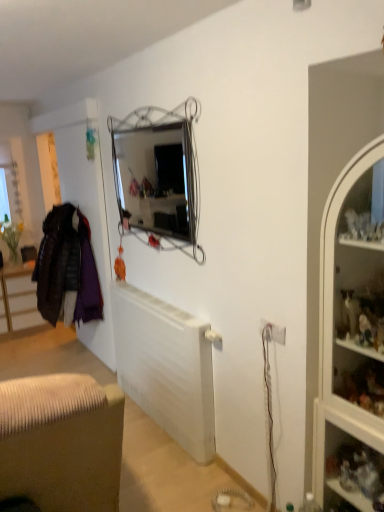
Question: Would you say white glass cabinet at right contains white plastic electric outlet at lower right?

Choices:
 (A) yes
 (B) no

Answer: (B)

Question: From the image's perspective, would you say white glass cabinet at right is positioned over white plastic electric outlet at lower right?

Choices:
 (A) no
 (B) yes

Answer: (B)

Question: Does white glass cabinet at right appear on the right side of white plastic electric outlet at lower right?

Choices:
 (A) no
 (B) yes

Answer: (B)

Question: Considering the relative sizes of white glass cabinet at right and white plastic electric outlet at lower right in the image provided, is white glass cabinet at right wider than white plastic electric outlet at lower right?

Choices:
 (A) yes
 (B) no

Answer: (A)

Question: Is white glass cabinet at right facing towards white plastic electric outlet at lower right?

Choices:
 (A) no
 (B) yes

Answer: (A)

Question: Is white glass cabinet at right further to the viewer compared to white plastic electric outlet at lower right?

Choices:
 (A) no
 (B) yes

Answer: (A)

Question: Is the position of clear glass shelves at right more distant than that of brown fabric cabinet at lower left?

Choices:
 (A) yes
 (B) no

Answer: (B)

Question: Is clear glass shelves at right taller than brown fabric cabinet at lower left?

Choices:
 (A) yes
 (B) no

Answer: (A)

Question: Does clear glass shelves at right have a larger size compared to brown fabric cabinet at lower left?

Choices:
 (A) yes
 (B) no

Answer: (B)

Question: Considering the relative sizes of clear glass shelves at right and brown fabric cabinet at lower left in the image provided, is clear glass shelves at right smaller than brown fabric cabinet at lower left?

Choices:
 (A) yes
 (B) no

Answer: (A)

Question: From a real-world perspective, is clear glass shelves at right beneath brown fabric cabinet at lower left?

Choices:
 (A) yes
 (B) no

Answer: (B)

Question: Does clear glass shelves at right have a lesser height compared to brown fabric cabinet at lower left?

Choices:
 (A) no
 (B) yes

Answer: (A)

Question: From the image's perspective, is clear glass shelves at right located beneath velvet purple coat at left?

Choices:
 (A) no
 (B) yes

Answer: (B)